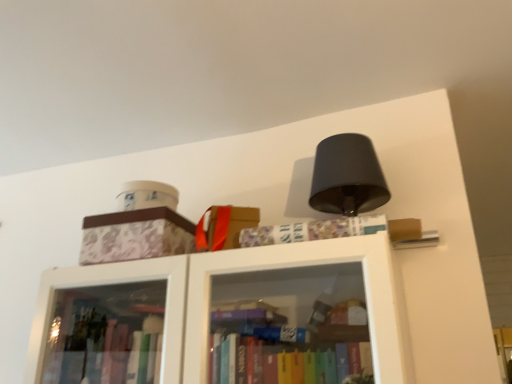
Question: Do you think patterned cardboard box at upper left is within patterned paper book at upper center, or outside of it?

Choices:
 (A) inside
 (B) outside

Answer: (B)

Question: In terms of height, does patterned cardboard box at upper left look taller or shorter compared to patterned paper book at upper center?

Choices:
 (A) short
 (B) tall

Answer: (B)

Question: Is point (150, 221) positioned closer to the camera than point (379, 226)?

Choices:
 (A) farther
 (B) closer

Answer: (A)

Question: Which is correct: patterned paper book at upper center is inside patterned cardboard box at upper left, or outside of it?

Choices:
 (A) inside
 (B) outside

Answer: (B)

Question: Considering the positions of patterned paper book at upper center and patterned cardboard box at upper left in the image, is patterned paper book at upper center wider or thinner than patterned cardboard box at upper left?

Choices:
 (A) wide
 (B) thin

Answer: (B)

Question: From their relative heights in the image, would you say patterned paper book at upper center is taller or shorter than patterned cardboard box at upper left?

Choices:
 (A) short
 (B) tall

Answer: (A)

Question: Looking at the image, does patterned paper book at upper center seem bigger or smaller compared to patterned cardboard box at upper left?

Choices:
 (A) small
 (B) big

Answer: (A)